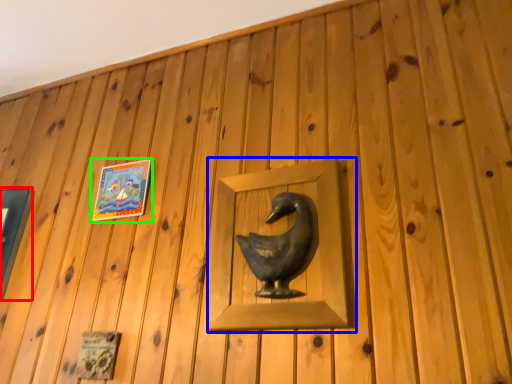
Question: Based on their relative distances, which object is nearer to picture frame (highlighted by a red box)? Choose from sculpture (highlighted by a blue box) and picture frame (highlighted by a green box).

Choices:
 (A) sculpture
 (B) picture frame

Answer: (B)